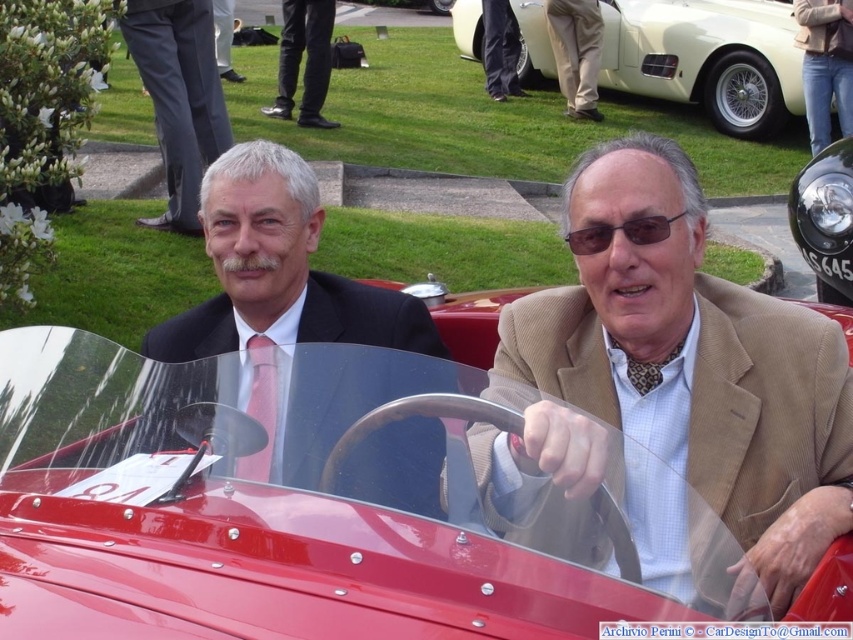
Between black leather shoes at center and dark brown textured sunglasses at center, which one has less height?

dark brown textured sunglasses at center

Does black leather shoes at center appear on the left side of dark brown textured sunglasses at center?

Indeed, black leather shoes at center is positioned on the left side of dark brown textured sunglasses at center.

Is point (312, 113) farther from viewer compared to point (598, 243)?

Yes, it is behind point (598, 243).

Locate an element on the screen. black leather shoes at center is located at coordinates (306, 60).

Is matte black suit at center above dark brown textured sunglasses at center?

No, matte black suit at center is not above dark brown textured sunglasses at center.

Can you confirm if matte black suit at center is taller than dark brown textured sunglasses at center?

Yes, matte black suit at center is taller than dark brown textured sunglasses at center.

At what (x,y) coordinates should I click in order to perform the action: click on matte black suit at center. Please return your answer as a coordinate pair (x, y). Looking at the image, I should click on (277, 269).

I want to click on matte black suit at center, so click(x=277, y=269).

Is point (173, 40) farther from camera compared to point (810, 262)?

Yes, it is.

Is gray suit at center positioned in front of black metal headlight at center?

No.

Where is `gray suit at center`? Image resolution: width=853 pixels, height=640 pixels. gray suit at center is located at coordinates (178, 97).

Image resolution: width=853 pixels, height=640 pixels. Identify the location of gray suit at center. (178, 97).